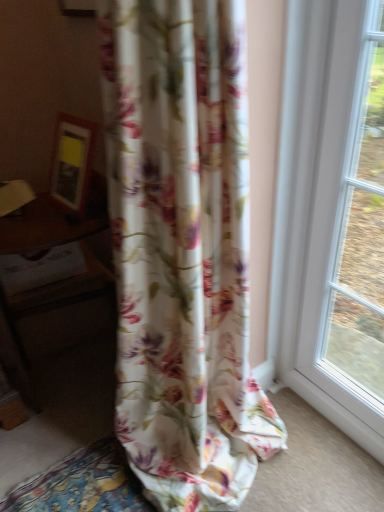
Where is `free space in front of wooden table at left`? free space in front of wooden table at left is located at coordinates (57, 459).